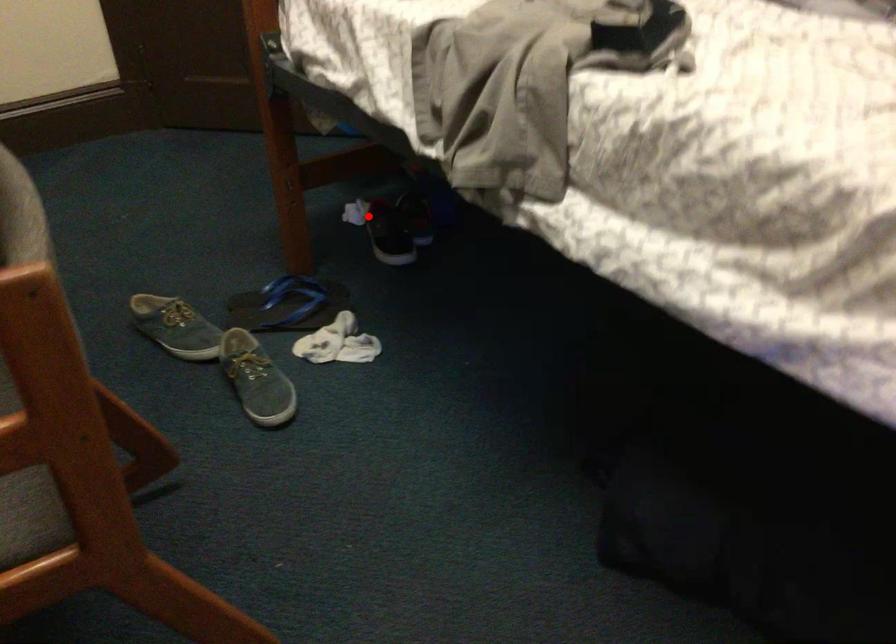
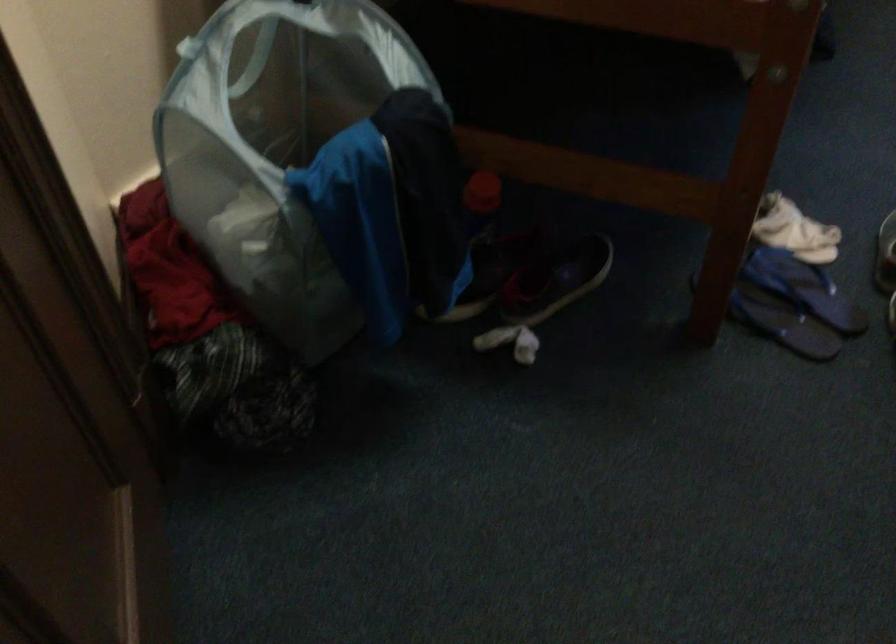
Question: I am providing you with two images of the same scene from different viewpoints. Given a red point in image1, look at the same physical point in image2. Is it:

Choices:
 (A) Closer to the viewpoint
 (B) Farther from the viewpoint

Answer: (A)